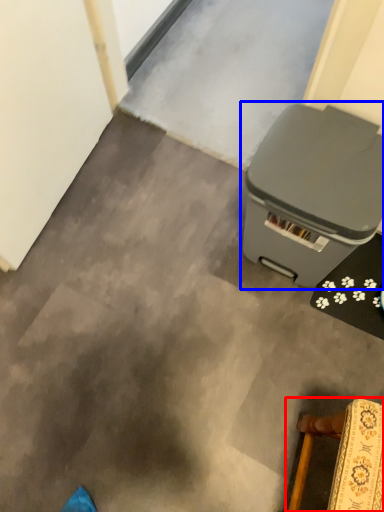
Question: Which object is further to the camera taking this photo, furniture (highlighted by a red box) or waste container (highlighted by a blue box)?

Choices:
 (A) furniture
 (B) waste container

Answer: (B)